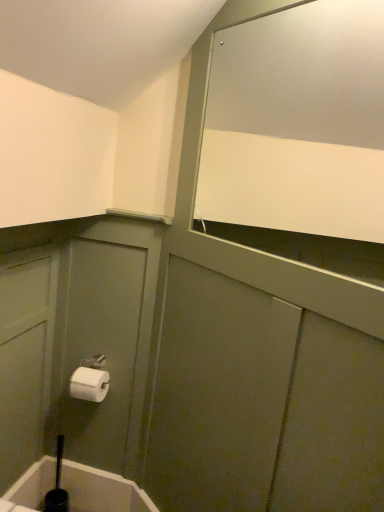
Question: From the image's perspective, is white matte toilet paper at lower left on top of white glossy mirror at upper right?

Choices:
 (A) no
 (B) yes

Answer: (A)

Question: From the image's perspective, is white matte toilet paper at lower left beneath white glossy mirror at upper right?

Choices:
 (A) yes
 (B) no

Answer: (A)

Question: Is white matte toilet paper at lower left at the right side of white glossy mirror at upper right?

Choices:
 (A) no
 (B) yes

Answer: (A)

Question: Are white matte toilet paper at lower left and white glossy mirror at upper right making contact?

Choices:
 (A) no
 (B) yes

Answer: (A)

Question: Can you confirm if white matte toilet paper at lower left is bigger than white glossy mirror at upper right?

Choices:
 (A) yes
 (B) no

Answer: (B)

Question: From a real-world perspective, is black rubber toilet brush at lower left physically located above or below white matte toilet paper at lower left?

Choices:
 (A) above
 (B) below

Answer: (B)

Question: In the image, is black rubber toilet brush at lower left on the left side or the right side of white matte toilet paper at lower left?

Choices:
 (A) right
 (B) left

Answer: (B)

Question: Is black rubber toilet brush at lower left in front of or behind white matte toilet paper at lower left in the image?

Choices:
 (A) front
 (B) behind

Answer: (B)

Question: Is black rubber toilet brush at lower left bigger or smaller than white matte toilet paper at lower left?

Choices:
 (A) small
 (B) big

Answer: (A)

Question: Looking at their shapes, would you say white glossy mirror at upper right is wider or thinner than white matte toilet paper at lower left?

Choices:
 (A) thin
 (B) wide

Answer: (A)

Question: From a real-world perspective, is white glossy mirror at upper right positioned above or below white matte toilet paper at lower left?

Choices:
 (A) below
 (B) above

Answer: (B)

Question: Is white glossy mirror at upper right to the left or to the right of white matte toilet paper at lower left in the image?

Choices:
 (A) left
 (B) right

Answer: (B)

Question: Based on their sizes in the image, would you say white glossy mirror at upper right is bigger or smaller than white matte toilet paper at lower left?

Choices:
 (A) big
 (B) small

Answer: (A)

Question: Looking at their shapes, would you say white glossy mirror at upper right is wider or thinner than black rubber toilet brush at lower left?

Choices:
 (A) wide
 (B) thin

Answer: (A)

Question: From the image's perspective, is white glossy mirror at upper right located above or below black rubber toilet brush at lower left?

Choices:
 (A) below
 (B) above

Answer: (B)